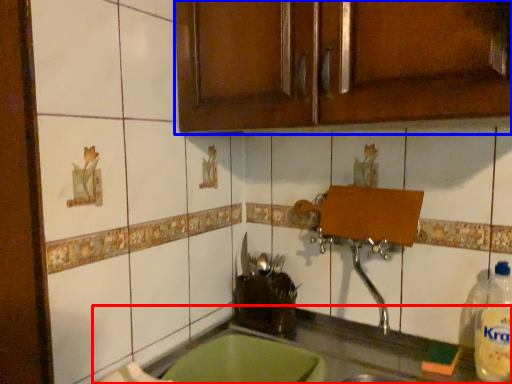
Question: Which point is closer to the camera, countertop (highlighted by a red box) or cabinetry (highlighted by a blue box)?

Choices:
 (A) countertop
 (B) cabinetry

Answer: (A)